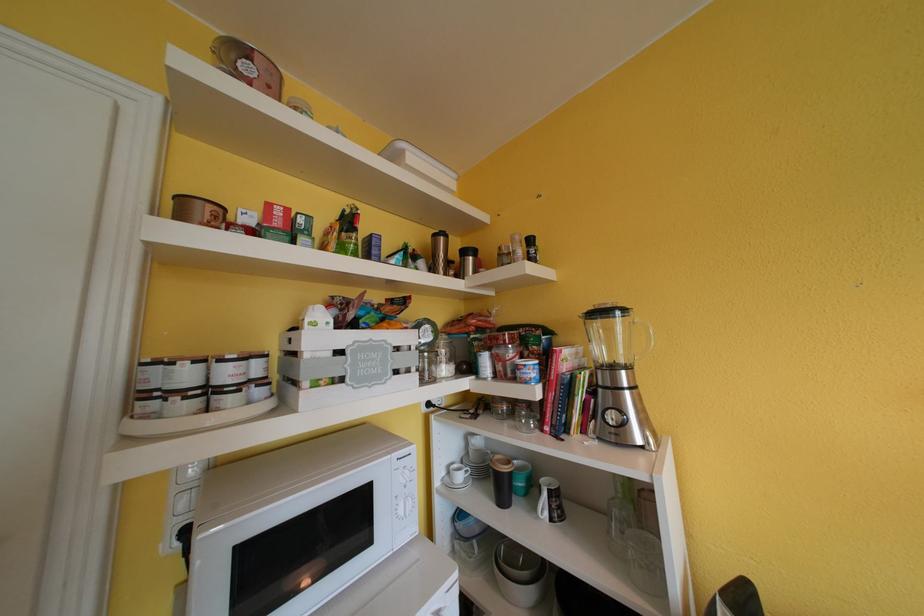
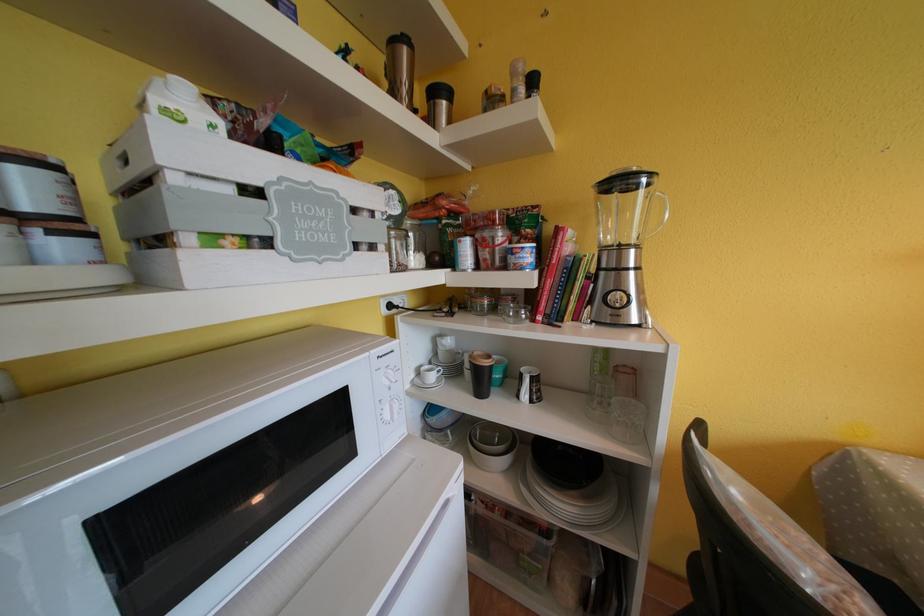
The images are taken continuously from a first-person perspective. In which direction are you moving?

The movement direction of the cameraman is left, forward.